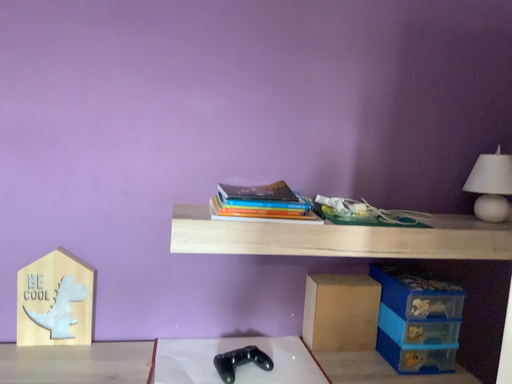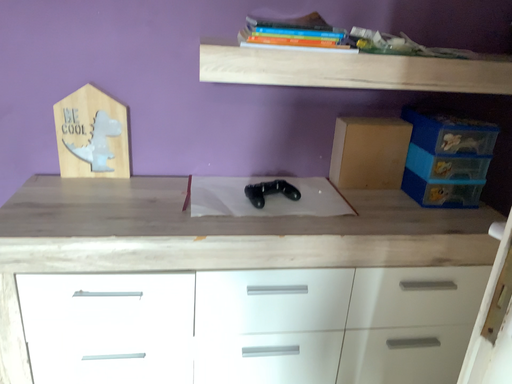
Question: How did the camera likely rotate when shooting the video?

Choices:
 (A) rotated upward
 (B) rotated downward

Answer: (B)